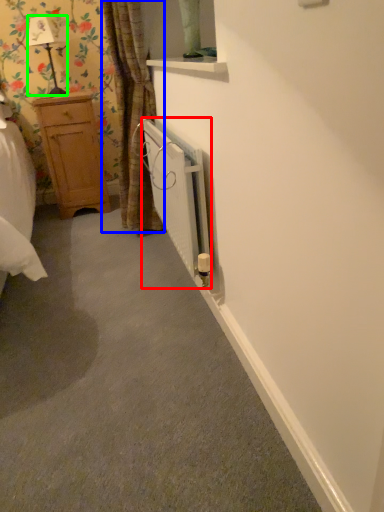
Question: Which is nearer to the radiator (highlighted by a red box)? curtain (highlighted by a blue box) or lamp (highlighted by a green box).

Choices:
 (A) curtain
 (B) lamp

Answer: (A)